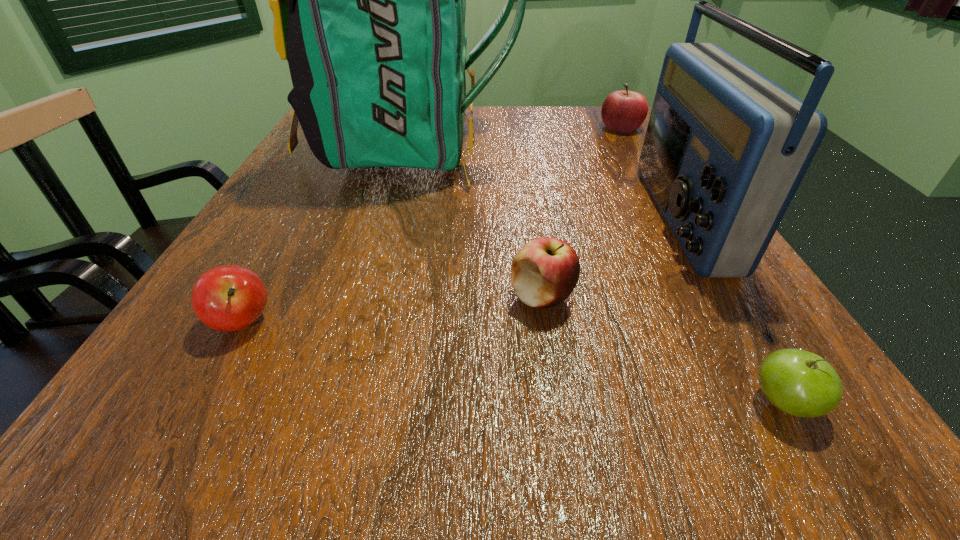
The width and height of the screenshot is (960, 540). I want to click on free space between the radio receiver and the second apple from left to right, so click(x=611, y=256).

You are a GUI agent. You are given a task and a screenshot of the screen. Output one action in this format:
    pyautogui.click(x=<x>, y=<y>)
    Task: Click on the vacant area that lies between the leftmost apple and the second apple from left to right
    Image resolution: width=960 pixels, height=540 pixels.
    Given the screenshot: What is the action you would take?
    pyautogui.click(x=393, y=309)

I want to click on empty location between the second tallest object and the backpack, so click(x=544, y=181).

You are a GUI agent. You are given a task and a screenshot of the screen. Output one action in this format:
    pyautogui.click(x=<x>, y=<y>)
    Task: Click on the free spot between the fifth shortest object and the third apple from right to left
    
    Given the screenshot: What is the action you would take?
    pyautogui.click(x=611, y=256)

Where is `free area in between the leftmost apple and the nearest object`? free area in between the leftmost apple and the nearest object is located at coordinates (513, 362).

Where is `vacant region between the second apple from left to right and the backpack`? The image size is (960, 540). vacant region between the second apple from left to right and the backpack is located at coordinates (476, 221).

Identify which object is the third closest to the second tallest object. Please provide its 2D coordinates. Your answer should be formatted as a tuple, i.e. [(x, y)], where the tuple contains the x and y coordinates of a point satisfying the conditions above.

[(544, 272)]

The height and width of the screenshot is (540, 960). What are the coordinates of `object that stands as the fifth closest to the leftmost apple` in the screenshot? It's located at (624, 111).

This screenshot has height=540, width=960. Identify the location of the closest apple to the leftmost apple. (544, 272).

Choose which apple is the second nearest neighbor to the leftmost apple. Please provide its 2D coordinates. Your answer should be formatted as a tuple, i.e. [(x, y)], where the tuple contains the x and y coordinates of a point satisfying the conditions above.

[(800, 383)]